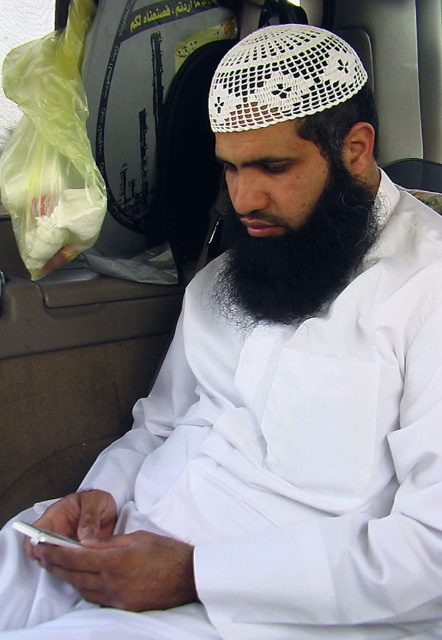
Is black matte beard at center closer to camera compared to white paper sign at upper center?

Yes, black matte beard at center is in front of white paper sign at upper center.

Measure the distance between black matte beard at center and white paper sign at upper center.

black matte beard at center is 28.11 inches from white paper sign at upper center.

Which is in front, point (265, 236) or point (140, 10)?

Point (265, 236) is in front.

The width and height of the screenshot is (442, 640). Identify the location of black matte beard at center. (300, 256).